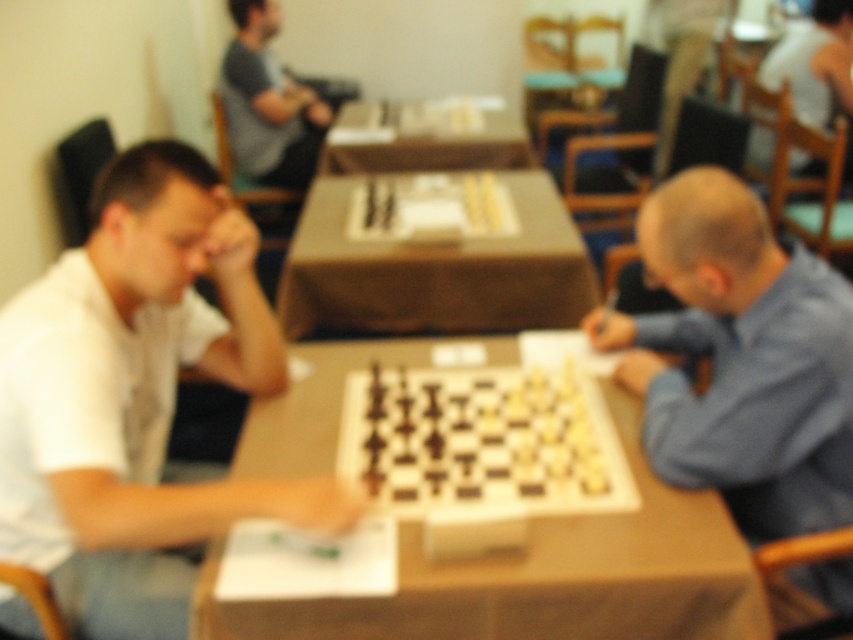
Question: Can you confirm if wooden chessboard at center is positioned to the right of brown fabric table at center?

Choices:
 (A) no
 (B) yes

Answer: (B)

Question: Estimate the real-world distances between objects in this image. Which object is farther from the wooden at center?

Choices:
 (A) blue fabric shirt at right
 (B) brown fabric table at center

Answer: (B)

Question: Does wooden at center have a lesser width compared to gray fabric shirt at upper center?

Choices:
 (A) no
 (B) yes

Answer: (A)

Question: Which point is farther to the camera?

Choices:
 (A) (631, 355)
 (B) (422, 250)
 (C) (352, 442)
 (D) (519, 632)

Answer: (B)

Question: Observing the image, what is the correct spatial positioning of wooden at center in reference to wooden chessboard at center?

Choices:
 (A) right
 (B) left

Answer: (B)

Question: Among these points, which one is nearest to the camera?

Choices:
 (A) (448, 102)
 (B) (178, 272)
 (C) (753, 129)
 (D) (828, 289)

Answer: (B)